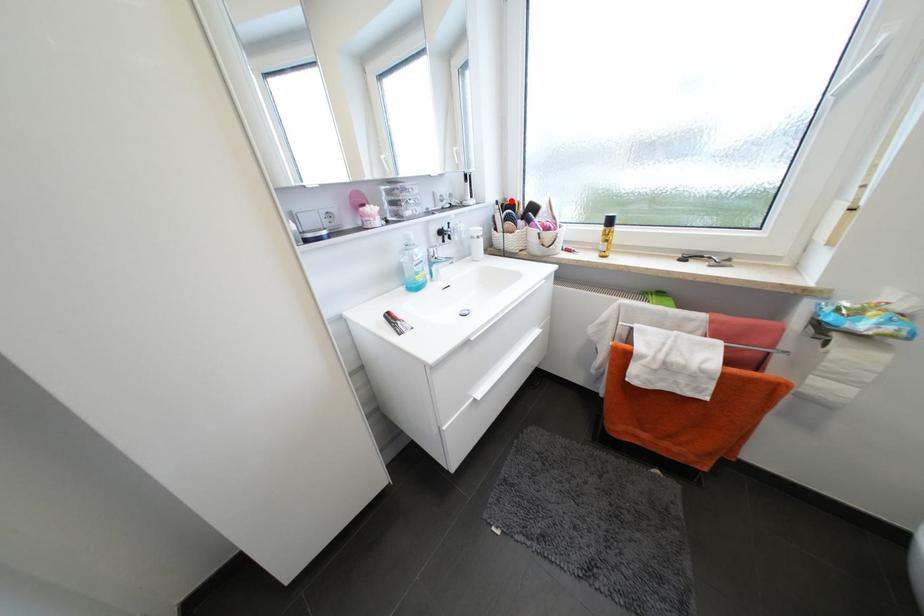
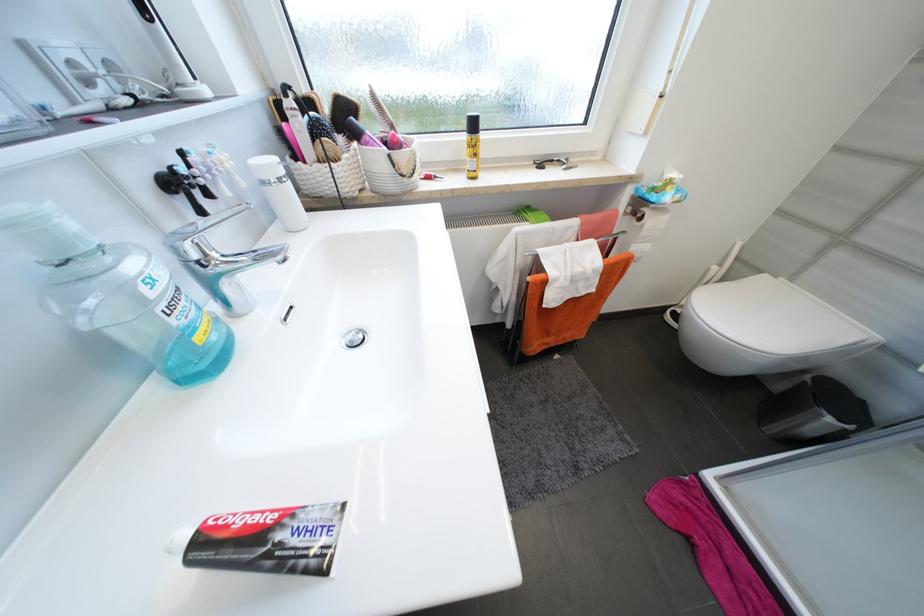
Question: I am providing you with two images of the same scene from different viewpoints. A red point is shown in image1. For the corresponding object point in image2, is it positioned nearer or farther from the camera?

Choices:
 (A) Nearer
 (B) Farther

Answer: (B)